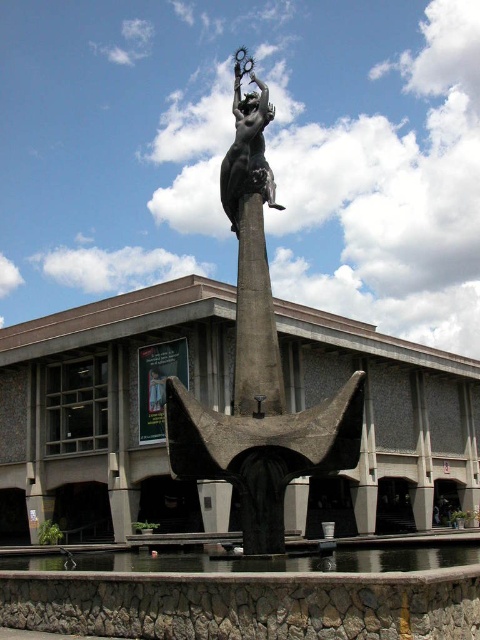
Between slate gray stone pillar at center and polished bronze statue at center, which one is positioned higher?

polished bronze statue at center

Between slate gray stone pillar at center and polished bronze statue at center, which one has more height?

Standing taller between the two is polished bronze statue at center.

Who is more forward, (272, 410) or (255, 188)?

Point (272, 410) is more forward.

This screenshot has width=480, height=640. I want to click on slate gray stone pillar at center, so click(254, 320).

Looking at this image, does bronze statue at center have a smaller size compared to slate gray stone pillar at center?

No.

Is bronze statue at center below slate gray stone pillar at center?

Correct, bronze statue at center is located below slate gray stone pillar at center.

Describe the element at coordinates (259, 364) in the screenshot. I see `bronze statue at center` at that location.

The height and width of the screenshot is (640, 480). In order to click on bronze statue at center in this screenshot , I will do `click(259, 364)`.

Which of these two, bronze statue at center or polished bronze statue at center, stands shorter?

polished bronze statue at center is shorter.

Can you confirm if bronze statue at center is shorter than polished bronze statue at center?

No.

I want to click on bronze statue at center, so click(x=259, y=364).